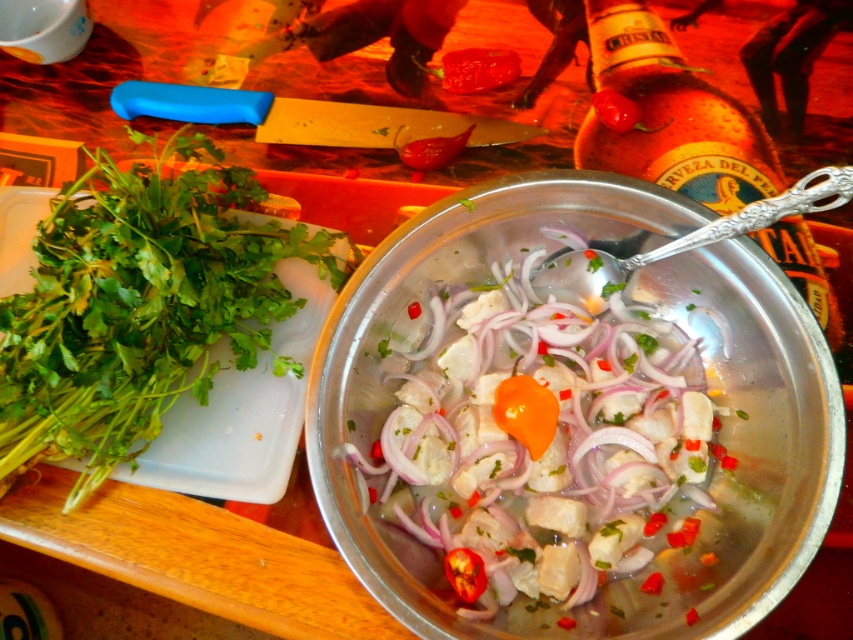
Question: Which point is closer to the camera taking this photo?

Choices:
 (A) (469, 58)
 (B) (166, 156)
 (C) (734, 115)
 (D) (503, 538)

Answer: (D)

Question: Is amber glass bottle at center to the left of bright red pepper at center from the viewer's perspective?

Choices:
 (A) no
 (B) yes

Answer: (A)

Question: Which object appears closest to the camera in this image?

Choices:
 (A) green leafy herb at left
 (B) amber glass bottle at center
 (C) white glossy fish at center
 (D) bright red pepper at center

Answer: (C)

Question: In this image, where is white glossy fish at center located relative to amber glass bottle at center?

Choices:
 (A) left
 (B) right

Answer: (A)

Question: Can you confirm if green leafy herb at left is positioned below bright red pepper at center?

Choices:
 (A) no
 (B) yes

Answer: (B)

Question: Which point is closer to the camera taking this photo?

Choices:
 (A) (469, 54)
 (B) (447, 404)

Answer: (B)